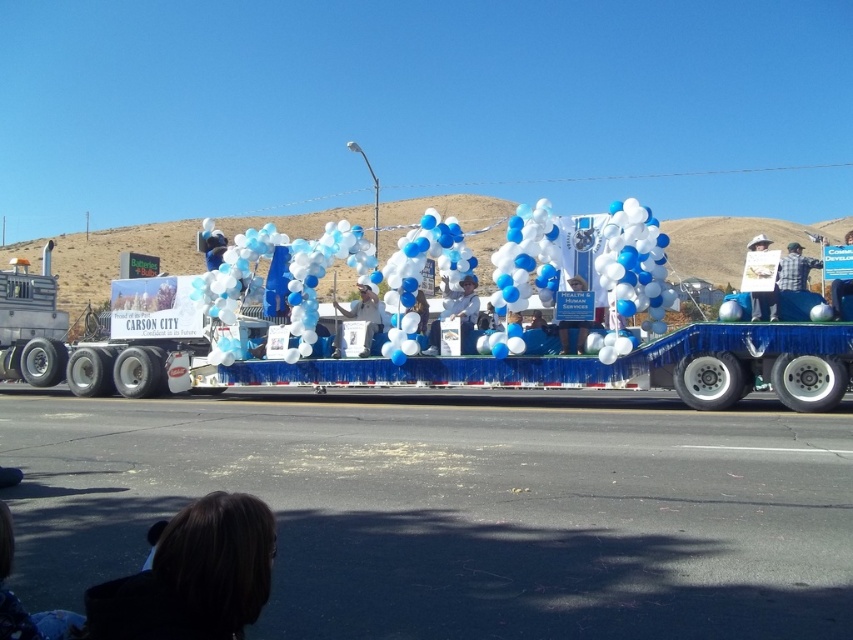
Question: Does blue glossy sign at center have a larger size compared to white paper sign at upper right?

Choices:
 (A) no
 (B) yes

Answer: (A)

Question: Which object is closer to the camera taking this photo?

Choices:
 (A) blue glossy sign at center
 (B) dark brown hair at lower left
 (C) white paper sign at upper right

Answer: (B)

Question: Where is dark brown hair at lower left located in relation to white paper sign at upper right in the image?

Choices:
 (A) above
 (B) below

Answer: (B)

Question: Does white plush hat at center have a lesser width compared to blue glossy sign at center?

Choices:
 (A) yes
 (B) no

Answer: (B)

Question: Which of these objects is positioned closest to the white plush hat at center?

Choices:
 (A) blue glossy balloons at center
 (B) dark brown hair at lower left
 (C) white paper sign at center
 (D) plaid shirt at right

Answer: (A)

Question: Which object is closer to the camera taking this photo?

Choices:
 (A) blue glossy balloons at center
 (B) blue glossy sign at center

Answer: (A)